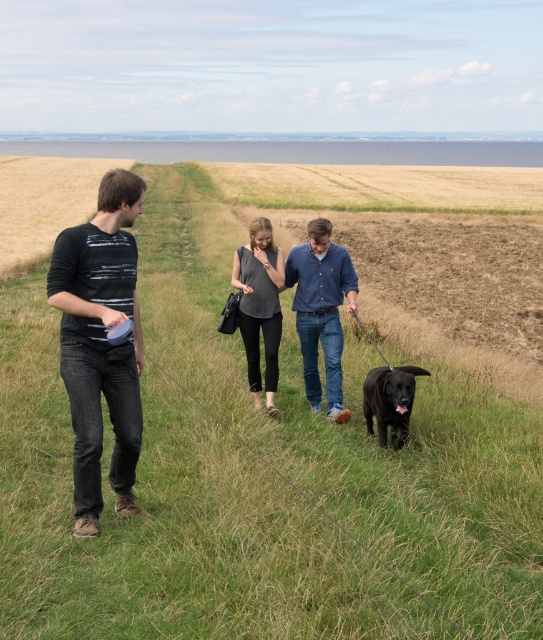
You are a photographer trying to capture a group photo of the dark gray striped shirt at left and the matte gray shirt at center. If you want to ensure both subjects are in focus, which one should you adjust your camera focus to prioritize based on their sizes?

The dark gray striped shirt at left is wider than the matte gray shirt at center, so you should prioritize focusing on the larger subject first to ensure clarity.

You are a photographer trying to capture a group photo of the dark gray striped shirt at left and the black matte dog at lower center. Since you want to ensure both subjects are in focus, you need to know which one is closer to you. Which subject is nearer to your camera position?

The dark gray striped shirt at left has a larger size compared to the black matte dog at lower center, which indicates it is closer to the camera. Therefore, the dark gray striped shirt at left is nearer to your camera position.